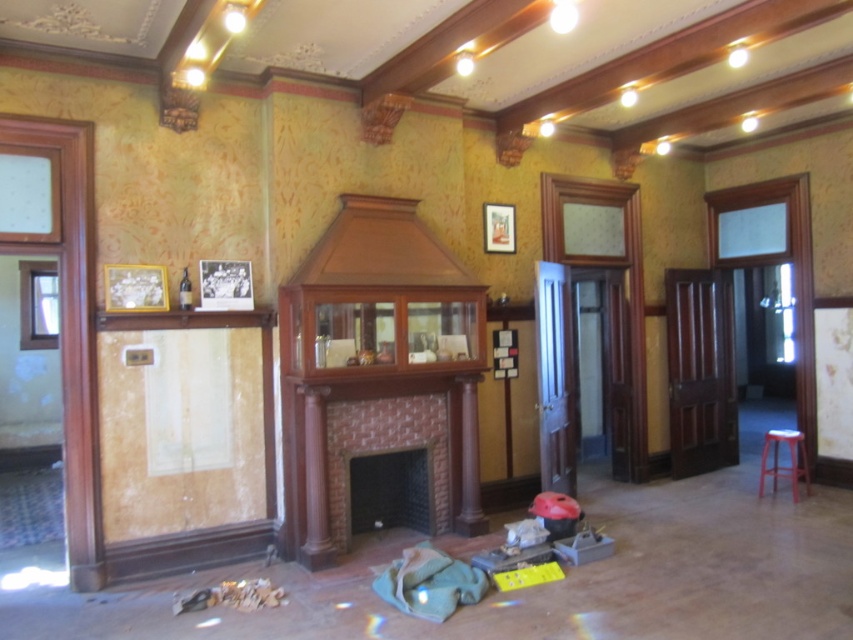
Looking at this image, you are standing in the center of the room and want to walk towards the point that is closer to the fireplace. Which point should you head towards, point (241, 326) or point (479, 492)?

Point (241, 326) is in front of point (479, 492), so it is closer to the fireplace. You should head towards point (241, 326).